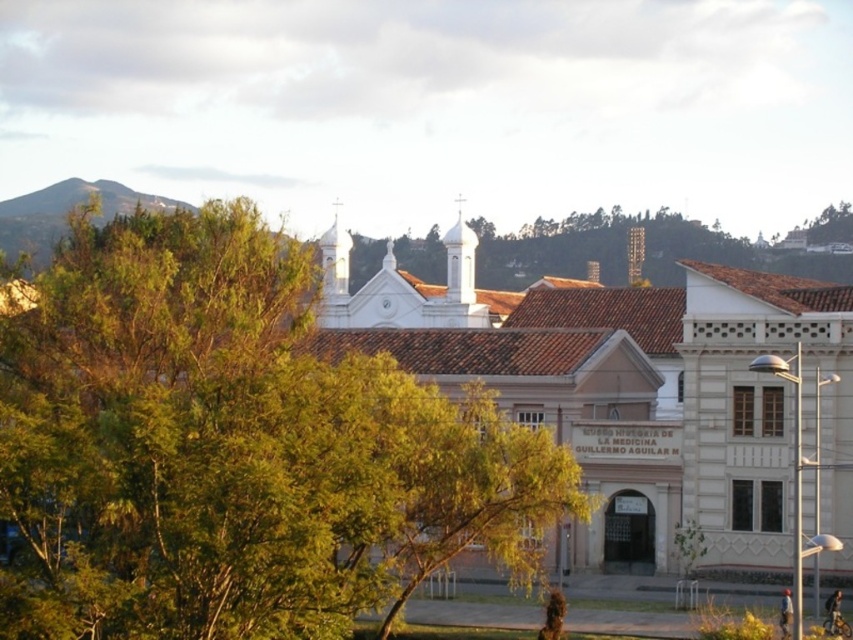
Which is more to the right, green leafy tree at center or brick bell tower at upper center?

From the viewer's perspective, brick bell tower at upper center appears more on the right side.

Does green leafy tree at center have a lesser width compared to brick bell tower at upper center?

No.

What are the coordinates of `green leafy tree at center` in the screenshot? It's located at (234, 449).

Find the location of a particular element. The width and height of the screenshot is (853, 640). green leafy tree at center is located at coordinates (234, 449).

Between white smooth bell tower at upper center and brick bell tower at upper center, which one has less height?

white smooth bell tower at upper center

Is the position of white smooth bell tower at upper center less distant than that of brick bell tower at upper center?

Yes, white smooth bell tower at upper center is closer to the viewer.

Which is in front, point (460, 202) or point (636, 268)?

Point (460, 202)

Find the location of `white smooth bell tower at upper center`. white smooth bell tower at upper center is located at coordinates (460, 259).

Who is lower down, green leafy tree at center or white smooth bell tower at upper center?

green leafy tree at center is lower down.

Is green leafy tree at center bigger than white smooth bell tower at upper center?

Yes, green leafy tree at center is bigger than white smooth bell tower at upper center.

Between point (231, 573) and point (468, 296), which one is positioned behind?

The point (468, 296) is more distant.

Locate an element on the screen. The width and height of the screenshot is (853, 640). green leafy tree at center is located at coordinates (234, 449).